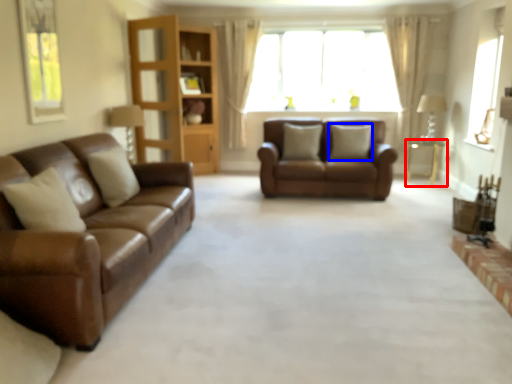
Question: Which object appears farthest to the camera in this image, table (highlighted by a red box) or pillow (highlighted by a blue box)?

Choices:
 (A) table
 (B) pillow

Answer: (A)